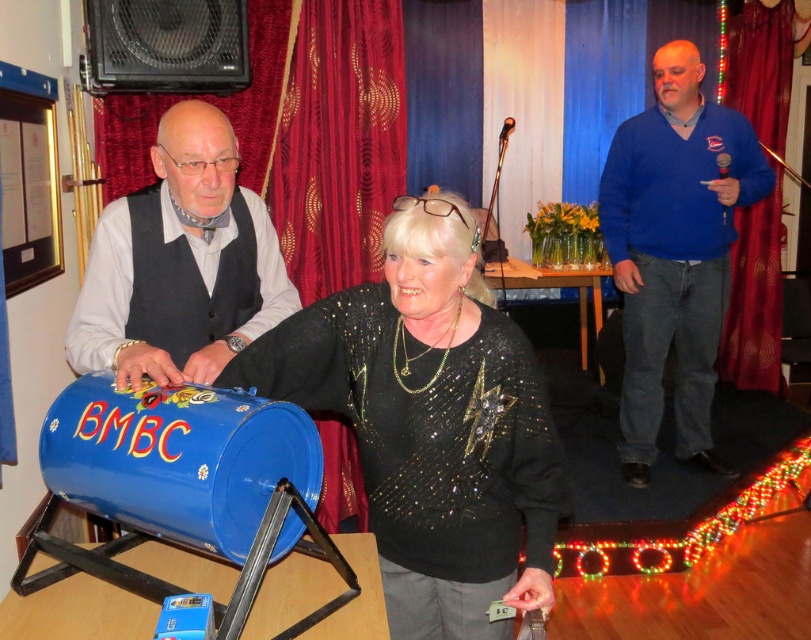
You are standing at the entrance of the event hall and see two points marked in the scene. Which point is closer to you, point (526,422) or point (162,161)?

Point (526,422) is closer to the viewer than point (162,161).

You are a photographer positioned at the back of the room and want to take a photo of both the blue sweater at right and the brushed metal drum at left. Which object will appear closer to the camera in the photo?

The blue sweater at right will appear closer to the camera because it is further to the viewer than the brushed metal drum at left.